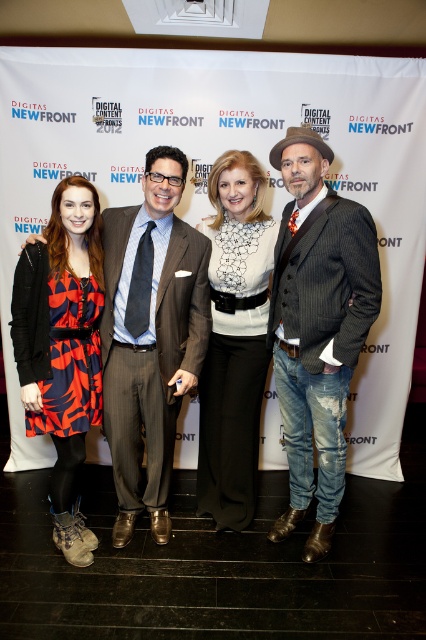
Between point (51, 476) and point (325, 156), which one is positioned behind?

Point (51, 476)

Does printed fabric dress at center have a greater width compared to brown felt cowboy hat at upper right?

Indeed, printed fabric dress at center has a greater width compared to brown felt cowboy hat at upper right.

Who is more distant from viewer, (66, 410) or (316, 140)?

The point (66, 410) is behind.

You are a GUI agent. You are given a task and a screenshot of the screen. Output one action in this format:
    pyautogui.click(x=<x>, y=<y>)
    Task: Click on the printed fabric dress at center
    The image size is (426, 640).
    Given the screenshot: What is the action you would take?
    pyautogui.click(x=63, y=348)

Between printed fabric dress at center and gray pinstripe suit at center, which one appears on the right side from the viewer's perspective?

gray pinstripe suit at center is more to the right.

Who is positioned more to the left, printed fabric dress at center or gray pinstripe suit at center?

printed fabric dress at center

Who is more forward, (58, 305) or (138, 385)?

Point (58, 305) is in front.

Locate an element on the screen. printed fabric dress at center is located at coordinates (63, 348).

From the picture: Who is shorter, white satin blouse at center or gray pinstripe suit at center?

With less height is gray pinstripe suit at center.

Based on the photo, is white satin blouse at center smaller than gray pinstripe suit at center?

No, white satin blouse at center is not smaller than gray pinstripe suit at center.

Does point (224, 212) come closer to viewer compared to point (166, 316)?

That is False.

This screenshot has width=426, height=640. In order to click on white satin blouse at center in this screenshot , I will do `click(235, 339)`.